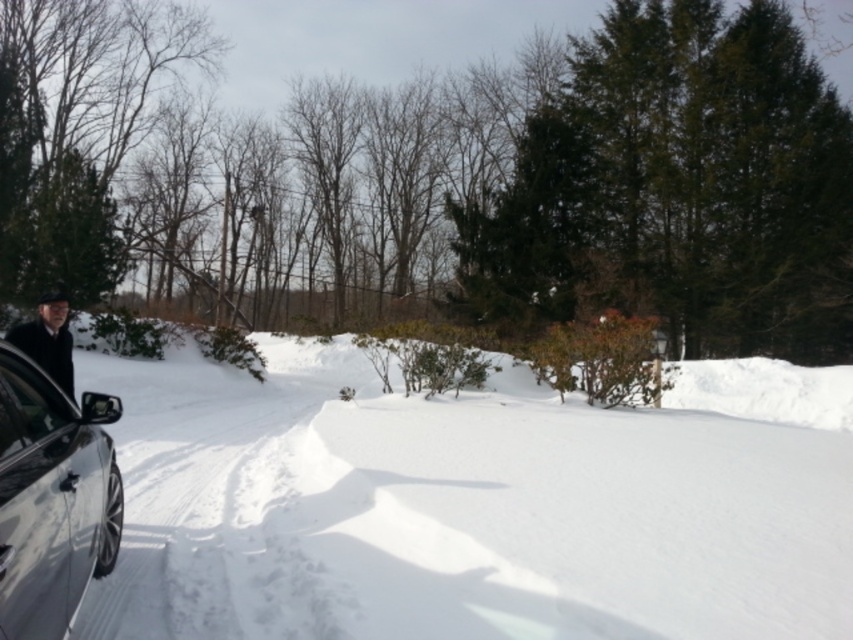
Based on the photo, you are standing in the snowy landscape and want to walk from point (209, 365) to point (74, 472). Which direction should you face to move towards the latter point?

Since point (209, 365) is further to the viewer than point 0.739, 089, you should face away from the direction of the house to move towards the latter point.

You are standing at the point labeled as point (51,497) in the snowy landscape. What object is located at that point?

The point (51,497) indicates a shiny metallic car at left.

You are standing in the snowy driveway and want to see your reflection in the clear glass window at lower left. Where should you stand to see your reflection?

To see your reflection in the clear glass window at lower left, you should stand directly in front of it, facing the window. Since the window is at point (32, 426), you need to position yourself at that coordinate to see your reflection.